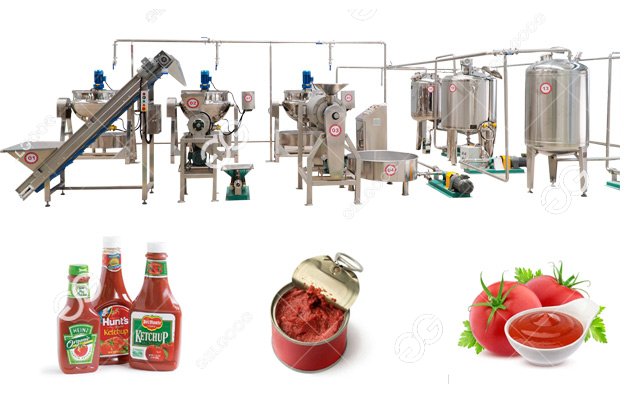
Where is `small white dish`? small white dish is located at coordinates (557, 354).